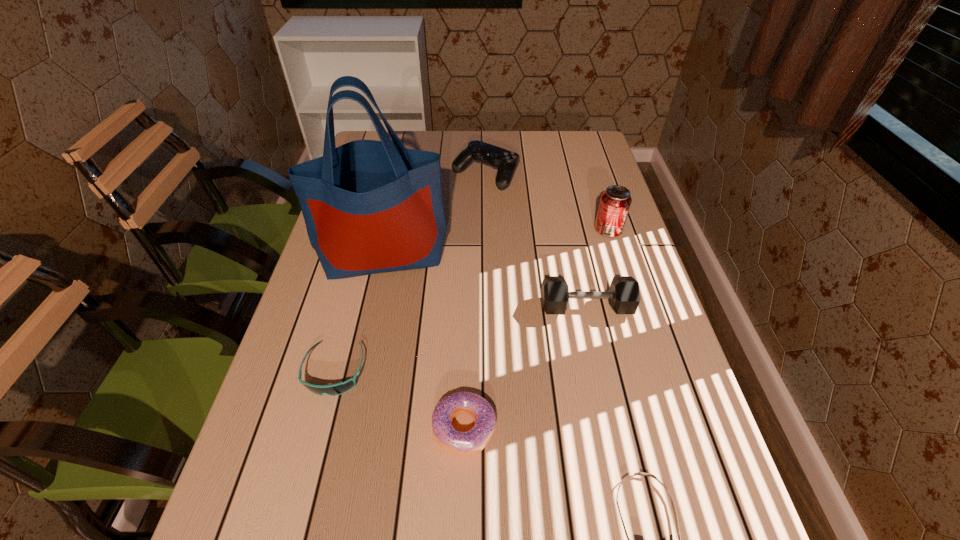
Identify the location of vacant position located on the front of the dumbbell. The height and width of the screenshot is (540, 960). (611, 420).

Find the location of a particular element. This screenshot has width=960, height=540. free spot located 0.180m on the back of the doughnut is located at coordinates (468, 327).

Locate an element on the screen. free spot located on the front-facing side of the fifth farthest object is located at coordinates (306, 479).

Find the location of a particular element. The image size is (960, 540). object at the far edge is located at coordinates (506, 161).

Where is `handbag positioned at the left edge`? The width and height of the screenshot is (960, 540). handbag positioned at the left edge is located at coordinates (369, 206).

At what (x,y) coordinates should I click in order to perform the action: click on sunglasses at the left edge. Please return your answer as a coordinate pair (x, y). This screenshot has height=540, width=960. Looking at the image, I should click on (335, 389).

The width and height of the screenshot is (960, 540). Find the location of `soda can located in the right edge section of the desktop`. soda can located in the right edge section of the desktop is located at coordinates (615, 202).

Identify the location of dumbbell present at the right edge. The image size is (960, 540). (624, 297).

Identify the location of vacant space at the left edge of the desktop. (295, 502).

Locate an element on the screen. This screenshot has width=960, height=540. vacant space at the right edge is located at coordinates pyautogui.click(x=584, y=265).